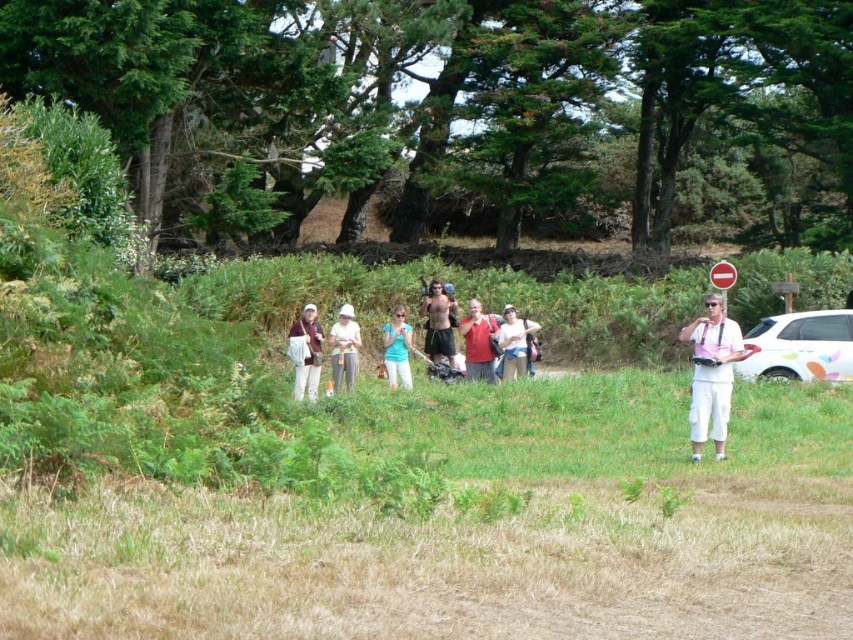
You are a photographer trying to capture a clear shot of the white glossy car at right without any people blocking it. Since the matte blue shirt at center is in the way, can you suggest a direction to move so that the car becomes visible?

The white glossy car at right is positioned under the matte blue shirt at center. To capture a clear shot of the white glossy car at right without the matte blue shirt at center blocking it, you should move to the left side of the current position. This will shift your viewpoint so that the car is no longer obscured by the person wearing the matte blue shirt at center.